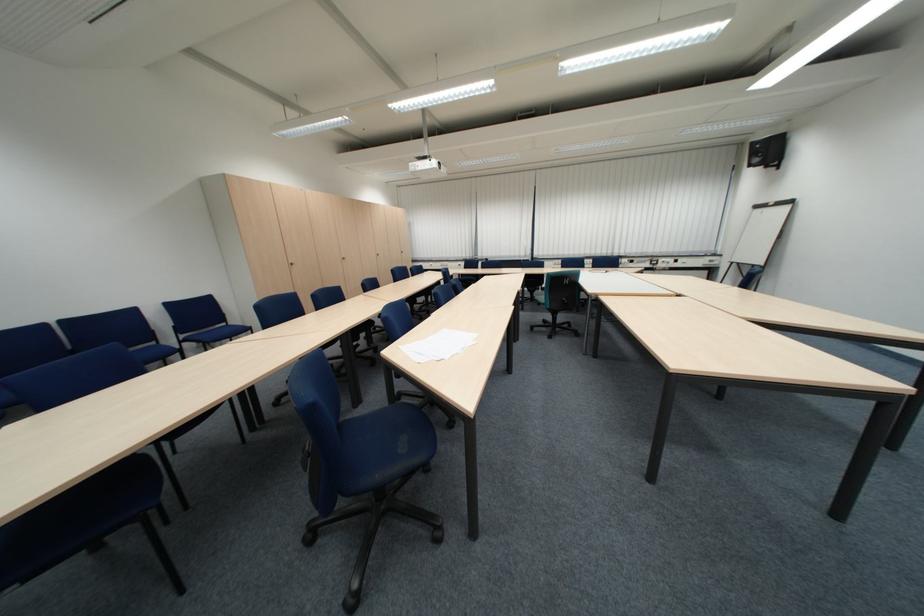
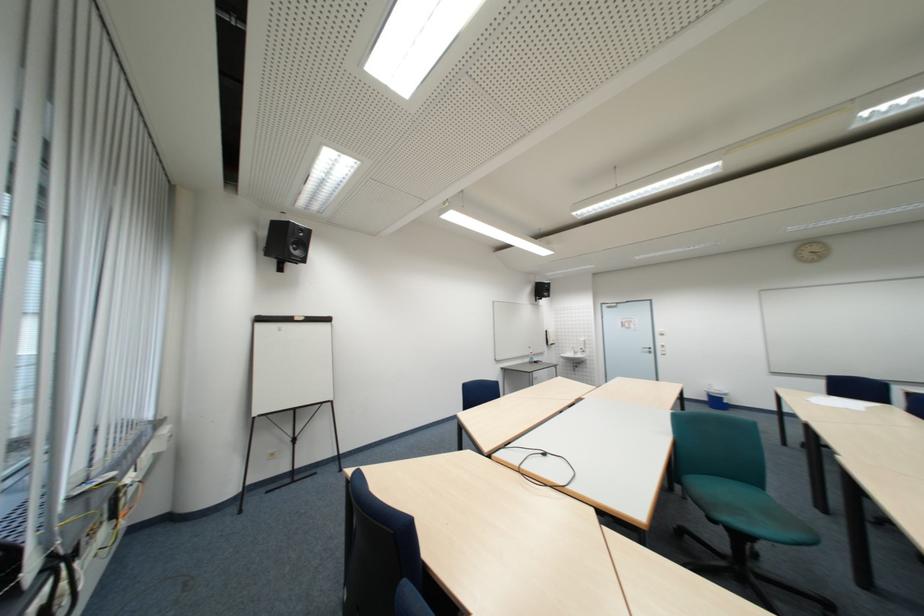
Where in the second image is the point corresponding to [771,208] from the first image?

(273, 321)